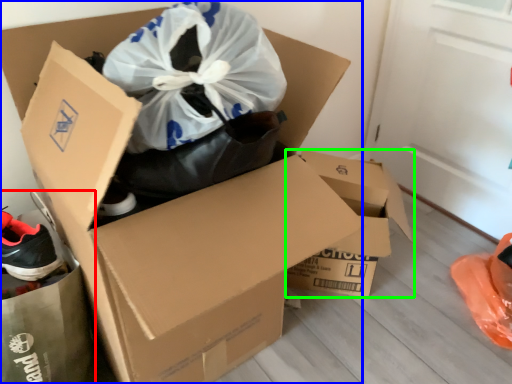
Question: Which is farther away from garbage (highlighted by a red box)? box (highlighted by a blue box) or box (highlighted by a green box)?

Choices:
 (A) box
 (B) box

Answer: (B)